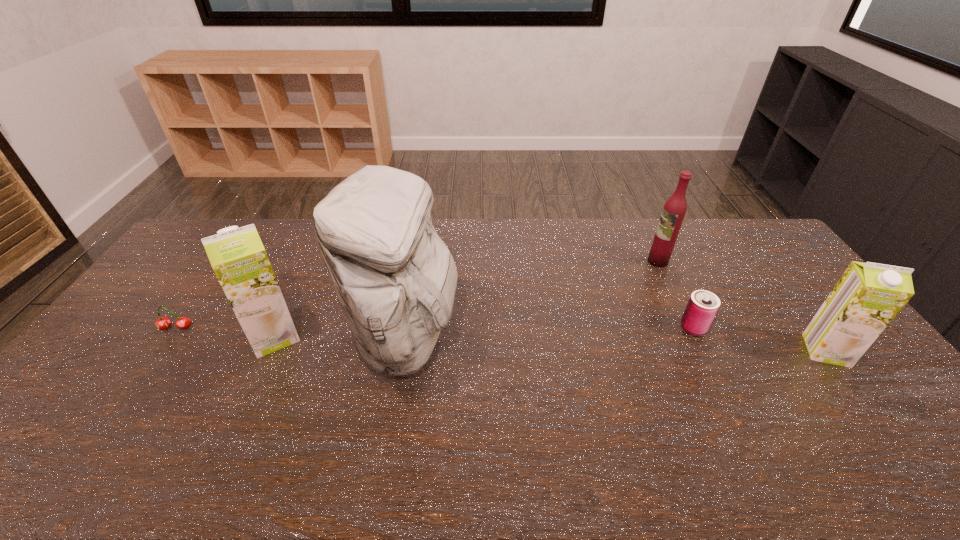
Identify the location of the taller soya milk. Image resolution: width=960 pixels, height=540 pixels. [237, 255].

At what (x,y) coordinates should I click in order to perform the action: click on the left soya milk. Please return your answer as a coordinate pair (x, y). Looking at the image, I should click on (237, 255).

This screenshot has height=540, width=960. What are the coordinates of `the rightmost object` in the screenshot? It's located at (868, 296).

Locate an element on the screen. The image size is (960, 540). the right soya milk is located at coordinates (868, 296).

The image size is (960, 540). In order to click on cherry in this screenshot , I will do `click(162, 323)`.

At what (x,y) coordinates should I click in order to perform the action: click on the leftmost object. Please return your answer as a coordinate pair (x, y). This screenshot has height=540, width=960. Looking at the image, I should click on (162, 323).

Identify the location of can. This screenshot has width=960, height=540. (702, 307).

Locate an element on the screen. This screenshot has height=540, width=960. the farthest object is located at coordinates (674, 209).

Find the location of a particular element. the third object from left to right is located at coordinates (395, 279).

Identify the location of the tallest object. This screenshot has width=960, height=540. (395, 279).